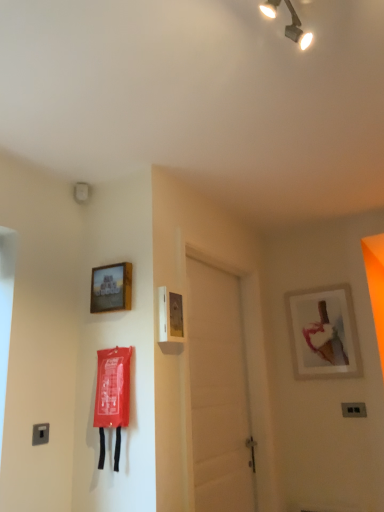
Question: From the image's perspective, is white matte door at center located above or below satin silver switch at lower left, the second light switch when ordered from bottom to top?

Choices:
 (A) above
 (B) below

Answer: (A)

Question: From a real-world perspective, relative to satin silver switch at lower left, marked as the first light switch in a top-to-bottom arrangement, is white matte door at center vertically above or below?

Choices:
 (A) below
 (B) above

Answer: (B)

Question: Which object is the closest to the satin silver switch at lower left, arranged as the second light switch when viewed from the right?

Choices:
 (A) black plastic light switch at lower right, which ranks as the 2th light switch in left-to-right order
 (B) wooden frame at upper left, the 1th picture frame positioned from the top
 (C) white matte door at center
 (D) metallic track lighting at upper center
 (E) matte white picture frame at upper right, which is the first picture frame from bottom to top

Answer: (B)

Question: Estimate the real-world distances between objects in this image. Which object is closer to the white matte door at center?

Choices:
 (A) black plastic light switch at lower right, which ranks as the first light switch in right-to-left order
 (B) wooden frame at upper left, the 1th picture frame when ordered from front to back
 (C) satin silver switch at lower left, placed as the 1th light switch when sorted from left to right
 (D) metallic track lighting at upper center
 (E) matte white picture frame at upper right, which is the first picture frame from bottom to top

Answer: (E)